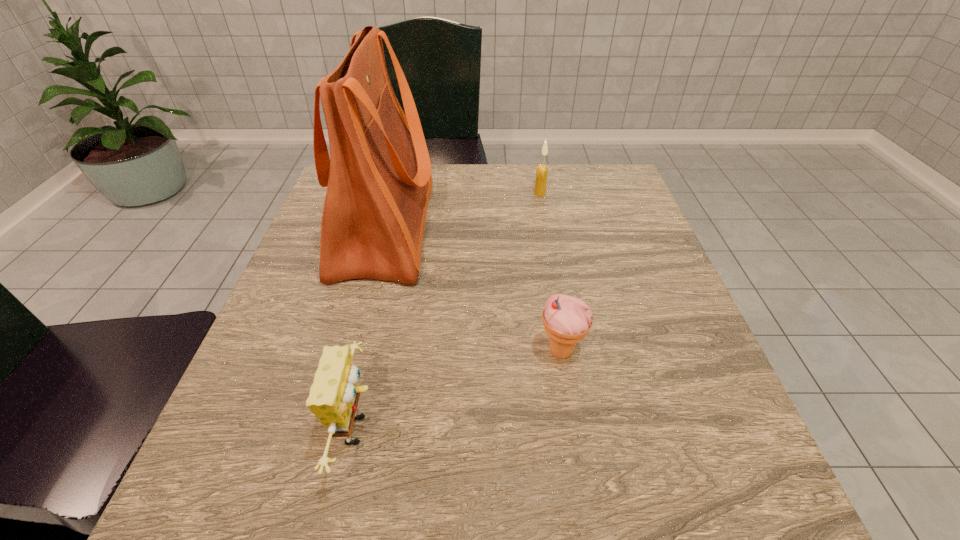
Identify the location of object that is at the near edge. (334, 395).

In order to click on object that is positioned at the left edge in this screenshot , I will do `click(378, 177)`.

At what (x,y) coordinates should I click in order to perform the action: click on object present at the far left corner. Please return your answer as a coordinate pair (x, y). Image resolution: width=960 pixels, height=540 pixels. Looking at the image, I should click on (378, 177).

This screenshot has height=540, width=960. Find the location of `free space at the far edge`. free space at the far edge is located at coordinates (458, 188).

Locate an element on the screen. vacant point at the left edge is located at coordinates (276, 329).

In the image, there is a desktop. At what (x,y) coordinates should I click in order to perform the action: click on free space at the right edge. Please return your answer as a coordinate pair (x, y). The height and width of the screenshot is (540, 960). Looking at the image, I should click on (715, 369).

Image resolution: width=960 pixels, height=540 pixels. What are the coordinates of `vacant space at the far left corner of the desktop` in the screenshot? It's located at (322, 205).

What are the coordinates of `free space at the near left corner` in the screenshot? It's located at (276, 490).

You are a GUI agent. You are given a task and a screenshot of the screen. Output one action in this format:
    pyautogui.click(x=<x>, y=<y>)
    Task: Click on the vacant point at the far right corner
    
    Given the screenshot: What is the action you would take?
    pyautogui.click(x=578, y=209)

In the image, there is a desktop. At what (x,y) coordinates should I click in order to perform the action: click on vacant region at the near right corner. Please return your answer as a coordinate pair (x, y). The image size is (960, 540). Looking at the image, I should click on (739, 515).